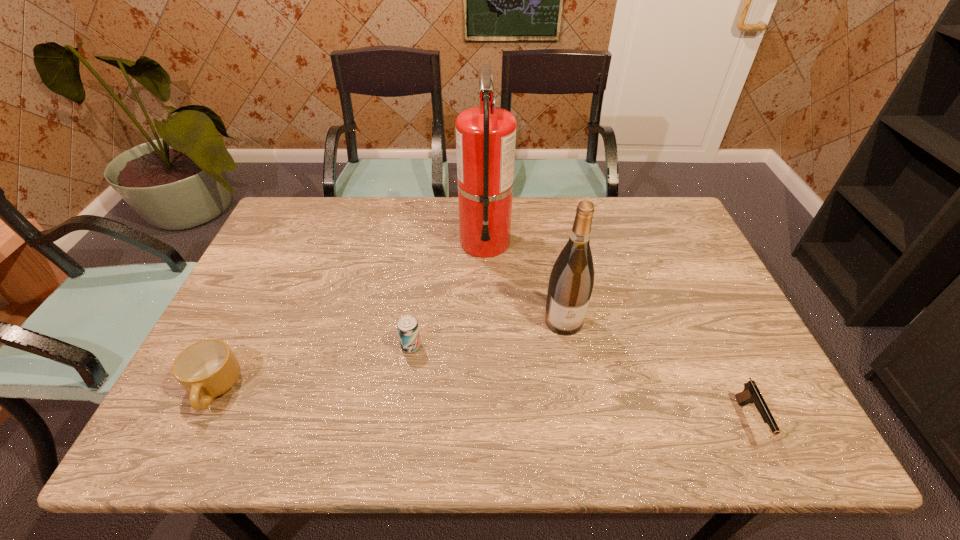
Identify the location of vacant point located between the third farthest object and the third object from right to left. (448, 294).

The width and height of the screenshot is (960, 540). Identify the location of blank region between the third object from left to right and the fourth object from left to right. (524, 281).

Find the location of a particular element. blank region between the mug and the fourth object from right to left is located at coordinates (312, 368).

The image size is (960, 540). In order to click on vacant space that is in between the pistol and the fourth shortest object in this screenshot , I will do `click(657, 371)`.

Identify the location of free spot between the shortest object and the beer can. The width and height of the screenshot is (960, 540). (580, 383).

Where is `object that is the fourth closest one to the fourth object from right to left`? The image size is (960, 540). object that is the fourth closest one to the fourth object from right to left is located at coordinates (751, 394).

Identify which object is the third closest to the beer can. Please provide its 2D coordinates. Your answer should be formatted as a tuple, i.e. [(x, y)], where the tuple contains the x and y coordinates of a point satisfying the conditions above.

[(206, 369)]